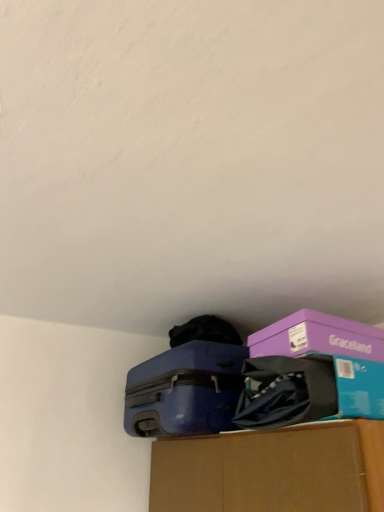
At what (x,y) coordinates should I click in order to perform the action: click on matte blue suitcase at center. Please return your answer as a coordinate pair (x, y). Looking at the image, I should click on (185, 391).

What are the coordinates of `purple cardboard box at upper right` in the screenshot? It's located at (318, 337).

The height and width of the screenshot is (512, 384). What do you see at coordinates (332, 356) in the screenshot?
I see `matte purple storage box at center` at bounding box center [332, 356].

Identify the location of matte blue suitcase at center. (185, 391).

Could you tell me if purple cardboard box at upper right is turned towards matte purple storage box at center?

No, purple cardboard box at upper right is not aimed at matte purple storage box at center.

Is purple cardboard box at upper right directly adjacent to matte purple storage box at center?

Yes, purple cardboard box at upper right is next to matte purple storage box at center.

From a real-world perspective, which object rests below the other?

matte purple storage box at center, from a real-world perspective.

Is the depth of purple cardboard box at upper right less than that of matte purple storage box at center?

No, purple cardboard box at upper right is further to the viewer.

Is purple cardboard box at upper right to the left of matte blue suitcase at center from the viewer's perspective?

No, purple cardboard box at upper right is not to the left of matte blue suitcase at center.

From a real-world perspective, who is located lower, purple cardboard box at upper right or matte blue suitcase at center?

matte blue suitcase at center.

Which of these two, purple cardboard box at upper right or matte blue suitcase at center, is bigger?

matte blue suitcase at center.

What's the angular difference between purple cardboard box at upper right and matte blue suitcase at center's facing directions?

The angle between the facing direction of purple cardboard box at upper right and the facing direction of matte blue suitcase at center is 4.71 degrees.

Can you confirm if matte blue suitcase at center is positioned to the right of purple cardboard box at upper right?

No.

Looking at this image, how different are the orientations of matte blue suitcase at center and purple cardboard box at upper right in degrees?

The facing directions of matte blue suitcase at center and purple cardboard box at upper right are 4.71 degrees apart.

Is matte blue suitcase at center completely or partially outside of purple cardboard box at upper right?

Yes, matte blue suitcase at center is located beyond the bounds of purple cardboard box at upper right.

Is matte blue suitcase at center facing towards purple cardboard box at upper right?

No.

From a real-world perspective, which is physically below, matte purple storage box at center or purple cardboard box at upper right?

From a 3D spatial view, matte purple storage box at center is below.

Does point (371, 350) come in front of point (311, 328)?

Yes.

Can you confirm if matte purple storage box at center is thinner than purple cardboard box at upper right?

No, matte purple storage box at center is not thinner than purple cardboard box at upper right.

Between matte blue suitcase at center and matte purple storage box at center, which one appears on the left side from the viewer's perspective?

Positioned to the left is matte blue suitcase at center.

This screenshot has width=384, height=512. Find the location of `suitcase above the matte purple storage box at center (from a real-world perspective)`. suitcase above the matte purple storage box at center (from a real-world perspective) is located at coordinates (185, 391).

Does matte blue suitcase at center lie behind matte purple storage box at center?

Yes, it is behind matte purple storage box at center.

Is matte purple storage box at center aimed at matte blue suitcase at center?

No, matte purple storage box at center is not facing towards matte blue suitcase at center.

Can matte blue suitcase at center be found inside matte purple storage box at center?

No, matte blue suitcase at center is not inside matte purple storage box at center.

From the image's perspective, which one is positioned lower, matte purple storage box at center or matte blue suitcase at center?

matte blue suitcase at center, from the image's perspective.

Where is `storage box on the right of purple cardboard box at upper right`? This screenshot has width=384, height=512. storage box on the right of purple cardboard box at upper right is located at coordinates (332, 356).

At what (x,y) coordinates should I click in order to perform the action: click on suitcase that appears on the left of purple cardboard box at upper right. Please return your answer as a coordinate pair (x, y). Image resolution: width=384 pixels, height=512 pixels. Looking at the image, I should click on (185, 391).

Considering their positions, is purple cardboard box at upper right positioned further to matte blue suitcase at center than matte purple storage box at center?

Answer: matte purple storage box at center lies further to matte blue suitcase at center than the other object.

From the image, which object appears to be nearer to matte purple storage box at center, purple cardboard box at upper right or matte blue suitcase at center?

purple cardboard box at upper right is positioned closer to the anchor matte purple storage box at center.

Which object lies nearer to the anchor point purple cardboard box at upper right, matte purple storage box at center or matte blue suitcase at center?

Based on the image, matte purple storage box at center appears to be nearer to purple cardboard box at upper right.

When comparing their distances from matte purple storage box at center, does matte blue suitcase at center or purple cardboard box at upper right seem further?

matte blue suitcase at center.

When comparing their distances from matte blue suitcase at center, does matte purple storage box at center or purple cardboard box at upper right seem closer?

Based on the image, purple cardboard box at upper right appears to be nearer to matte blue suitcase at center.

In the scene shown: Estimate the real-world distances between objects in this image. Which object is further from purple cardboard box at upper right, matte blue suitcase at center or matte purple storage box at center?

Result: Among the two, matte blue suitcase at center is located further to purple cardboard box at upper right.

Find the location of `box between matte blue suitcase at center and matte purple storage box at center`. box between matte blue suitcase at center and matte purple storage box at center is located at coordinates (318, 337).